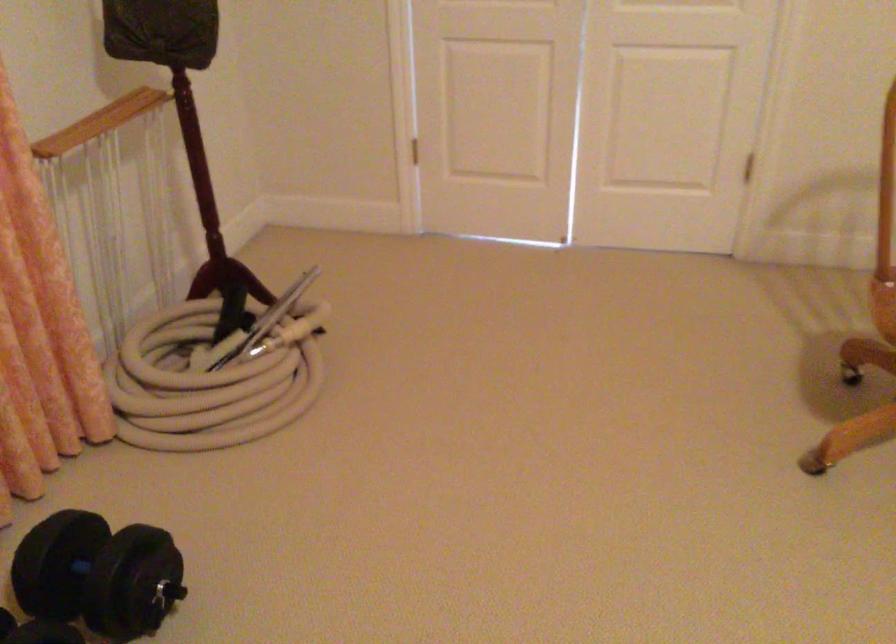
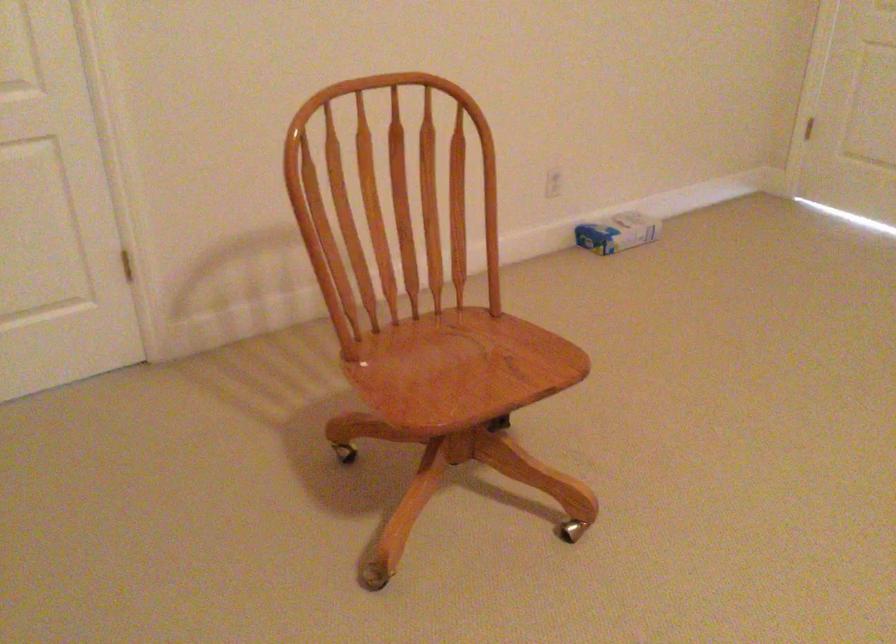
Question: How did the camera likely rotate?

Choices:
 (A) Left
 (B) Right
 (C) Up
 (D) Down

Answer: (B)